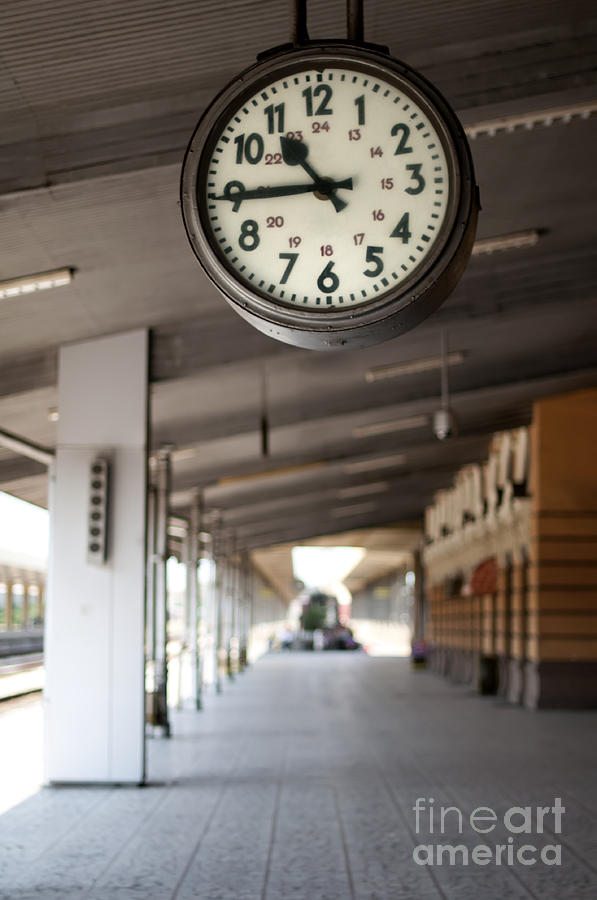
This screenshot has width=597, height=900. In order to click on security camera in this screenshot , I will do `click(447, 432)`.